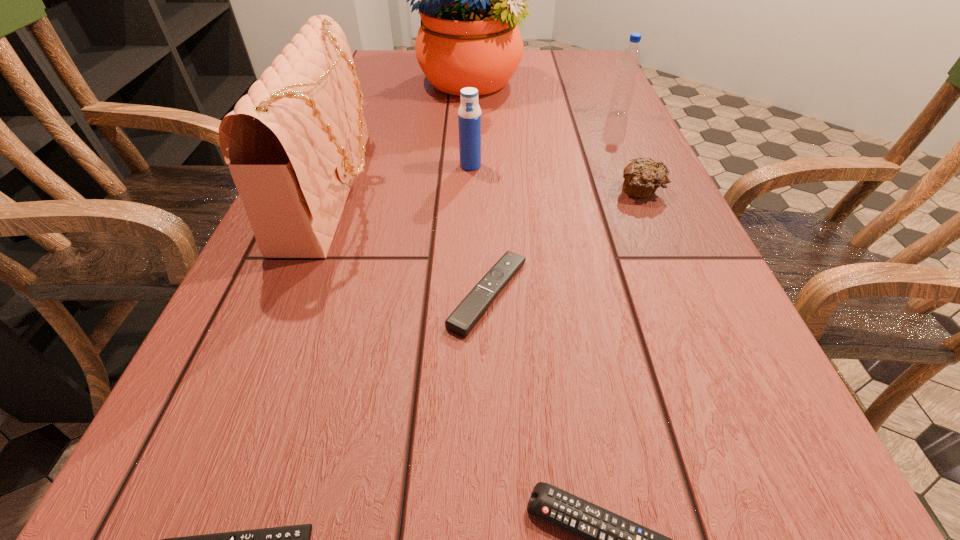
This screenshot has height=540, width=960. Find the location of `object that stands as the fourth closest to the farther water bottle`. object that stands as the fourth closest to the farther water bottle is located at coordinates (293, 144).

Select which remote control appears as the closest to the leftmost remote control. Please provide its 2D coordinates. Your answer should be formatted as a tuple, i.e. [(x, y)], where the tuple contains the x and y coordinates of a point satisfying the conditions above.

[(609, 539)]

Identify which remote control is the second nearest to the second shortest remote control. Please provide its 2D coordinates. Your answer should be formatted as a tuple, i.e. [(x, y)], where the tuple contains the x and y coordinates of a point satisfying the conditions above.

[(295, 539)]

Find the location of `vacant space that satisfies the following two spatial constraints: 1. on the front-facing side of the second tallest object; 2. on the left side of the muffin`. vacant space that satisfies the following two spatial constraints: 1. on the front-facing side of the second tallest object; 2. on the left side of the muffin is located at coordinates (333, 191).

This screenshot has height=540, width=960. What are the coordinates of `free spot that satisfies the following two spatial constraints: 1. on the front-facing side of the handbag; 2. on the right side of the fourth shortest object` in the screenshot? It's located at (333, 191).

The height and width of the screenshot is (540, 960). I want to click on vacant space that satisfies the following two spatial constraints: 1. on the front-facing side of the handbag; 2. on the right side of the farthest remote control, so click(293, 293).

Where is `free region that satisfies the following two spatial constraints: 1. on the front-facing side of the muffin; 2. on the right side of the handbag`? This screenshot has width=960, height=540. free region that satisfies the following two spatial constraints: 1. on the front-facing side of the muffin; 2. on the right side of the handbag is located at coordinates (333, 191).

The width and height of the screenshot is (960, 540). What are the coordinates of `free space that satisfies the following two spatial constraints: 1. on the back side of the tallest remote control; 2. on the right side of the muffin` in the screenshot? It's located at (487, 191).

At what (x,y) coordinates should I click in order to perform the action: click on vacant space that satisfies the following two spatial constraints: 1. on the back side of the seventh nearest object; 2. on the left side of the third shortest object. Please return your answer as a coordinate pair (x, y). The height and width of the screenshot is (540, 960). Looking at the image, I should click on (x=485, y=113).

The width and height of the screenshot is (960, 540). In order to click on vacant area that satisfies the following two spatial constraints: 1. on the front-facing side of the handbag; 2. on the left side of the sixth tallest object in this screenshot , I will do `click(293, 293)`.